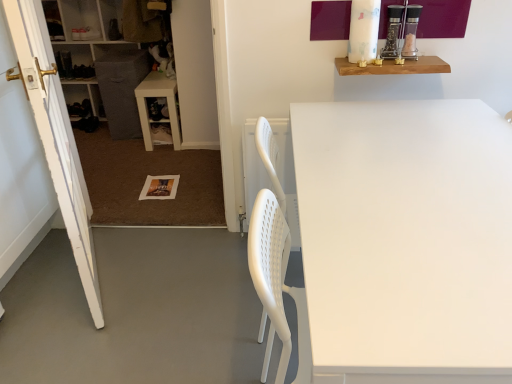
Question: Would you say wooden shelf at upper right is a long distance from white plastic cabinet at left?

Choices:
 (A) no
 (B) yes

Answer: (B)

Question: Is wooden shelf at upper right taller than white plastic cabinet at left?

Choices:
 (A) yes
 (B) no

Answer: (B)

Question: Is wooden shelf at upper right completely or partially outside of white plastic cabinet at left?

Choices:
 (A) yes
 (B) no

Answer: (A)

Question: Is wooden shelf at upper right beside white plastic cabinet at left?

Choices:
 (A) no
 (B) yes

Answer: (A)

Question: Is wooden shelf at upper right oriented towards white plastic cabinet at left?

Choices:
 (A) no
 (B) yes

Answer: (A)

Question: Is the depth of wooden shelf at upper right greater than that of white plastic cabinet at left?

Choices:
 (A) no
 (B) yes

Answer: (A)

Question: From a real-world perspective, is white painted wood door at left positioned under wooden shelf at upper right based on gravity?

Choices:
 (A) yes
 (B) no

Answer: (A)

Question: From the image's perspective, is white painted wood door at left under wooden shelf at upper right?

Choices:
 (A) no
 (B) yes

Answer: (B)

Question: Does white painted wood door at left have a lesser width compared to wooden shelf at upper right?

Choices:
 (A) yes
 (B) no

Answer: (A)

Question: Is white painted wood door at left turned away from wooden shelf at upper right?

Choices:
 (A) no
 (B) yes

Answer: (A)

Question: Does white painted wood door at left appear on the left side of wooden shelf at upper right?

Choices:
 (A) yes
 (B) no

Answer: (A)

Question: Does white painted wood door at left appear on the right side of wooden shelf at upper right?

Choices:
 (A) yes
 (B) no

Answer: (B)

Question: Is white painted wood door at left in front of white matte table at center, placed as the 2th table when sorted from left to right?

Choices:
 (A) no
 (B) yes

Answer: (A)